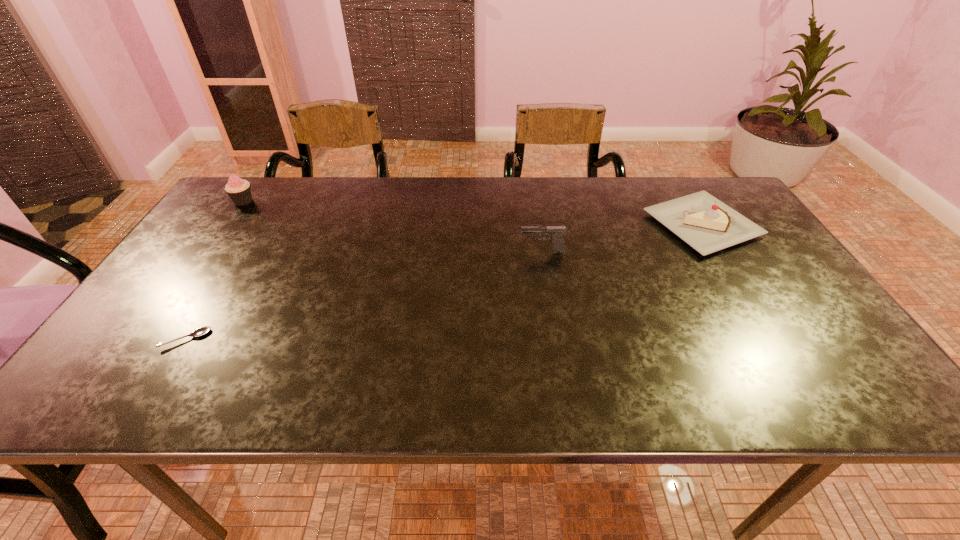
This screenshot has height=540, width=960. What are the coordinates of `free space located 0.350m on the front of the cake` in the screenshot? It's located at (792, 371).

The image size is (960, 540). In order to click on free space located 0.240m on the back of the shortest object in this screenshot , I will do `click(235, 259)`.

Identify the location of cupcake that is at the far edge. The image size is (960, 540). (239, 190).

This screenshot has width=960, height=540. I want to click on cake that is at the far edge, so click(x=708, y=225).

Image resolution: width=960 pixels, height=540 pixels. I want to click on cupcake situated at the left edge, so click(x=239, y=190).

Identify the location of soupspoon at the left edge. This screenshot has height=540, width=960. (200, 331).

At what (x,y) coordinates should I click in order to perform the action: click on object that is at the right edge. Please return your answer as a coordinate pair (x, y). The width and height of the screenshot is (960, 540). Looking at the image, I should click on coord(708,225).

The width and height of the screenshot is (960, 540). In order to click on object at the far left corner in this screenshot , I will do `click(239, 190)`.

Where is `object that is at the far right corner`? object that is at the far right corner is located at coordinates (708, 225).

The height and width of the screenshot is (540, 960). In the image, there is a desktop. What are the coordinates of `blank space at the far edge` in the screenshot? It's located at (600, 199).